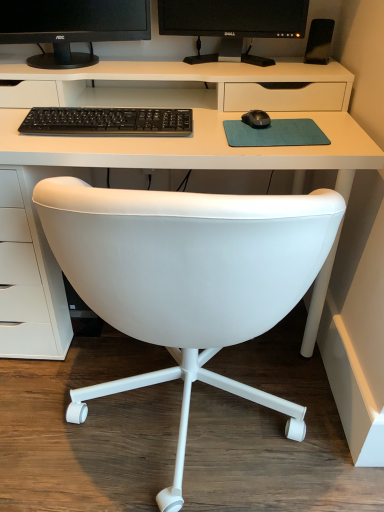
Question: Is black glossy monitor at upper center, which is the second computer monitor in left-to-right order, oriented towards black matte keyboard at center?

Choices:
 (A) yes
 (B) no

Answer: (A)

Question: Can you confirm if black glossy monitor at upper center, which ranks as the 1th computer monitor in right-to-left order, is bigger than black matte keyboard at center?

Choices:
 (A) no
 (B) yes

Answer: (B)

Question: Can you see black glossy monitor at upper center, which is the second computer monitor in left-to-right order, touching black matte keyboard at center?

Choices:
 (A) no
 (B) yes

Answer: (A)

Question: Is black glossy monitor at upper center, which is the second computer monitor in left-to-right order, positioned far away from black matte keyboard at center?

Choices:
 (A) no
 (B) yes

Answer: (A)

Question: Does black glossy monitor at upper center, which ranks as the 1th computer monitor in right-to-left order, come behind black matte keyboard at center?

Choices:
 (A) yes
 (B) no

Answer: (A)

Question: Can you confirm if black glossy monitor at upper center, which ranks as the 1th computer monitor in right-to-left order, is smaller than black matte keyboard at center?

Choices:
 (A) no
 (B) yes

Answer: (A)

Question: Can you confirm if black glossy monitor at upper center, which is the second computer monitor in left-to-right order, is taller than white plastic desk at center?

Choices:
 (A) no
 (B) yes

Answer: (A)

Question: Is black glossy monitor at upper center, which is the second computer monitor in left-to-right order, at the left side of white plastic desk at center?

Choices:
 (A) no
 (B) yes

Answer: (A)

Question: Does black glossy monitor at upper center, which is the second computer monitor in left-to-right order, come behind white plastic desk at center?

Choices:
 (A) yes
 (B) no

Answer: (A)

Question: Considering the relative sizes of black glossy monitor at upper center, which is the second computer monitor in left-to-right order, and white plastic desk at center in the image provided, is black glossy monitor at upper center, which is the second computer monitor in left-to-right order, smaller than white plastic desk at center?

Choices:
 (A) yes
 (B) no

Answer: (A)

Question: From a real-world perspective, is black glossy monitor at upper center, which is the second computer monitor in left-to-right order, over white plastic desk at center?

Choices:
 (A) yes
 (B) no

Answer: (A)

Question: Is black glossy monitor at upper center, which is the second computer monitor in left-to-right order, to the right of white plastic desk at center from the viewer's perspective?

Choices:
 (A) no
 (B) yes

Answer: (B)

Question: Is black matte speaker at upper right outside white plastic desk at center?

Choices:
 (A) no
 (B) yes

Answer: (B)